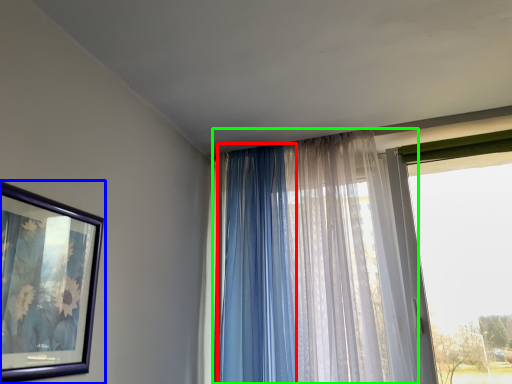
Question: Based on their relative distances, which object is nearer to curtain (highlighted by a red box)? Choose from picture frame (highlighted by a blue box) and curtain (highlighted by a green box).

Choices:
 (A) picture frame
 (B) curtain

Answer: (B)